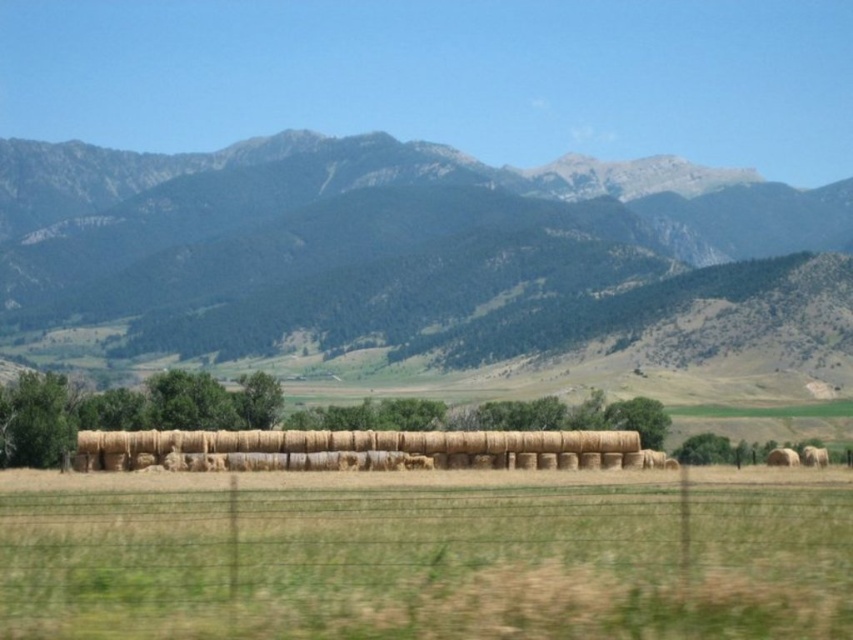
Is brown straw bales at center below golden straw bales at center?

Actually, brown straw bales at center is above golden straw bales at center.

Can you confirm if brown straw bales at center is wider than golden straw bales at center?

Correct, the width of brown straw bales at center exceeds that of golden straw bales at center.

Which is in front, point (836, 582) or point (357, 460)?

Point (836, 582) is more forward.

Locate an element on the screen. This screenshot has width=853, height=640. brown straw bales at center is located at coordinates (427, 554).

Is green textured mountain range at upper center to the left of brown straw bales at center from the viewer's perspective?

Incorrect, green textured mountain range at upper center is not on the left side of brown straw bales at center.

Who is more distant from viewer, (x=291, y=369) or (x=426, y=540)?

Positioned behind is point (x=291, y=369).

Describe the element at coordinates (416, 262) in the screenshot. I see `green textured mountain range at upper center` at that location.

You are a GUI agent. You are given a task and a screenshot of the screen. Output one action in this format:
    pyautogui.click(x=<x>, y=<y>)
    Task: Click on the green textured mountain range at upper center
    This screenshot has width=853, height=640.
    Given the screenshot: What is the action you would take?
    pyautogui.click(x=416, y=262)

Can you confirm if green textured mountain range at upper center is bigger than golden straw bales at center?

Yes, green textured mountain range at upper center is bigger than golden straw bales at center.

Can you confirm if green textured mountain range at upper center is taller than golden straw bales at center?

Correct, green textured mountain range at upper center is much taller as golden straw bales at center.

Who is more distant from viewer, (434, 236) or (514, 435)?

The point (434, 236) is more distant.

This screenshot has height=640, width=853. I want to click on green textured mountain range at upper center, so click(x=416, y=262).